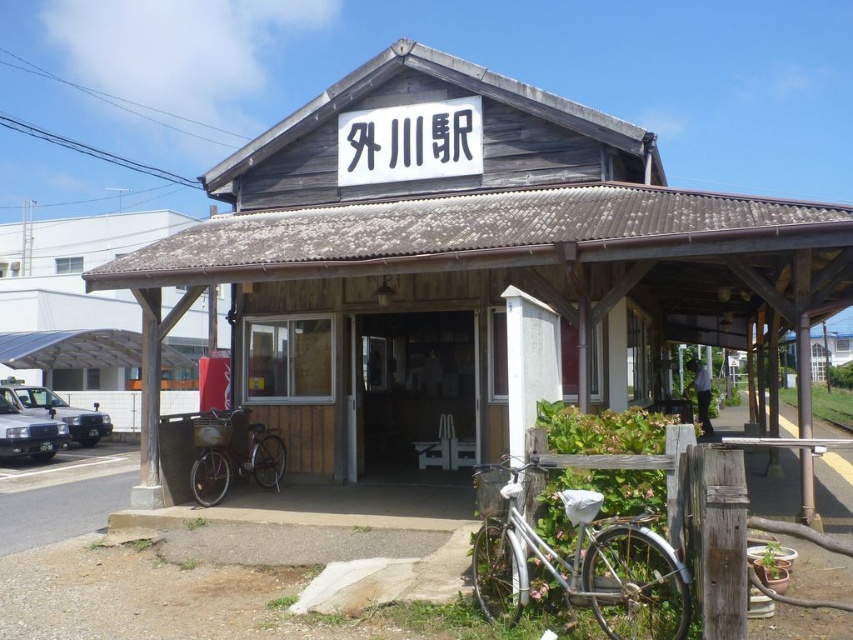
Question: Which of the following is the closest to the observer?

Choices:
 (A) silver metallic bicycle at center
 (B) weathered wood hut at center

Answer: (B)

Question: Which point appears closest to the camera in this image?

Choices:
 (A) (206, 497)
 (B) (90, 444)
 (C) (625, 522)

Answer: (C)

Question: Is silver metallic bicycle at lower right below silver metallic car at left?

Choices:
 (A) yes
 (B) no

Answer: (B)

Question: Which point is farther to the camera?

Choices:
 (A) weathered wood hut at center
 (B) silver metallic car at left

Answer: (B)

Question: Can you confirm if weathered wood hut at center is smaller than silver metallic bicycle at lower right?

Choices:
 (A) no
 (B) yes

Answer: (A)

Question: Is silver metallic bicycle at lower right below silver metallic bicycle at center?

Choices:
 (A) yes
 (B) no

Answer: (B)